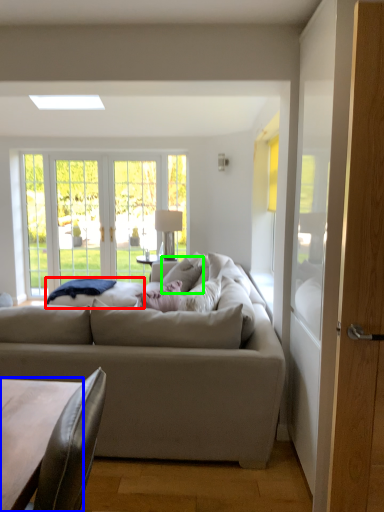
Question: Which is nearer to the wide (highlighted by a red box)? coffee table (highlighted by a blue box) or pillow (highlighted by a green box).

Choices:
 (A) coffee table
 (B) pillow

Answer: (B)